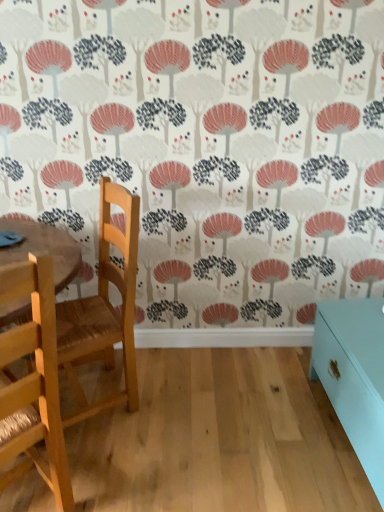
Question: From their relative heights in the image, would you say light wood chair at left, the second chair positioned from the back, is taller or shorter than teal glossy cabinet at lower right?

Choices:
 (A) tall
 (B) short

Answer: (A)

Question: From a real-world perspective, is light wood chair at left, arranged as the 1th chair when viewed from the front, positioned above or below teal glossy cabinet at lower right?

Choices:
 (A) below
 (B) above

Answer: (B)

Question: Which is nearer to the wooden chair at left, which is counted as the first chair, starting from the back?

Choices:
 (A) light wood chair at left, arranged as the 1th chair when viewed from the front
 (B) teal glossy cabinet at lower right

Answer: (A)

Question: Which of these objects is positioned closest to the light wood chair at left, the second chair positioned from the back?

Choices:
 (A) wooden chair at left, which appears as the second chair when viewed from the front
 (B) teal glossy cabinet at lower right

Answer: (A)